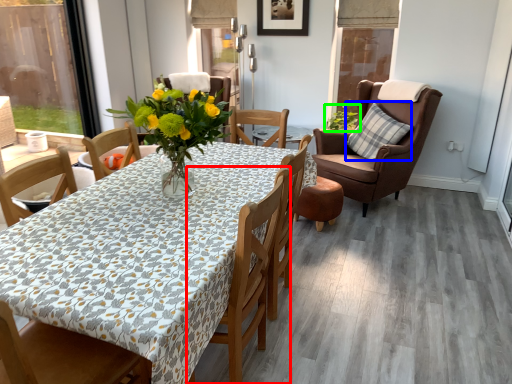
Question: Which is nearer to the chair (highlighted by a red box)? pillow (highlighted by a blue box) or houseplant (highlighted by a green box).

Choices:
 (A) pillow
 (B) houseplant

Answer: (A)